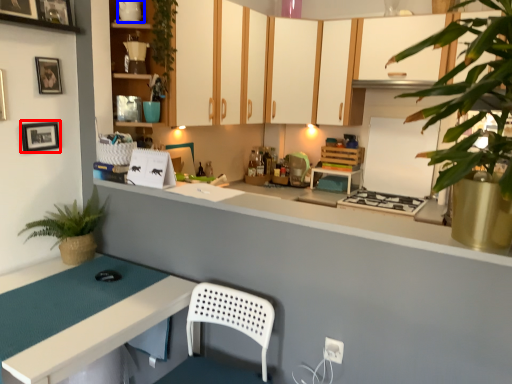
Question: Which point is further to the camera, picture frame (highlighted by a red box) or appliance (highlighted by a blue box)?

Choices:
 (A) picture frame
 (B) appliance

Answer: (B)